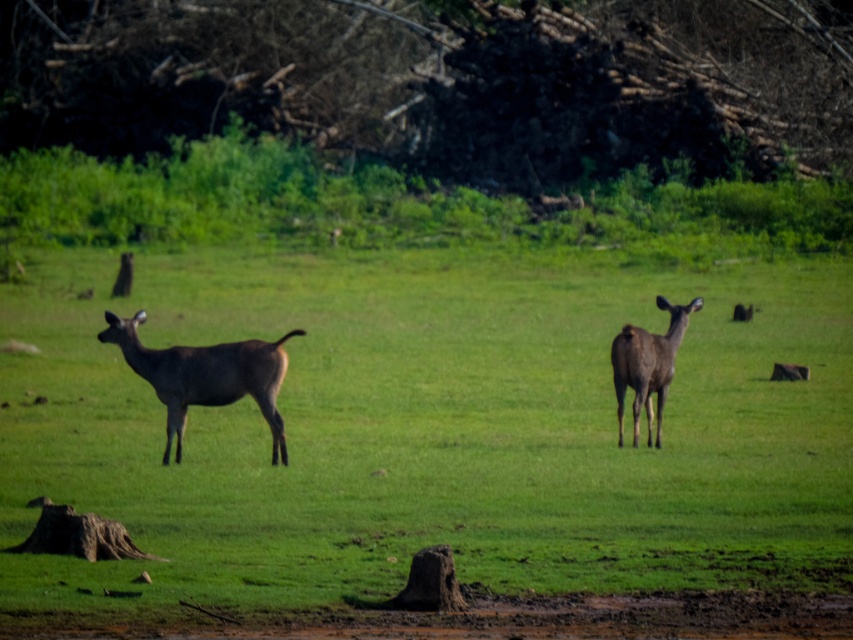
You are a wildlife photographer aiming to capture a closeup shot of the brown fur deer at center. Your camera has a maximum focus range of 30 feet. Can you get a clear closeup without moving closer?

The brown fur deer at center is 35.23 feet away from the camera. Since your camera can only focus up to 30 feet, you cannot get a clear closeup without moving closer.

You are a photographer trying to capture both the brown fur deer at center and the shiny brown deer at center in a single shot. Which deer will appear larger in your photo?

The brown fur deer at center will appear larger in the photo because it is closer to the viewer than the shiny brown deer at center.